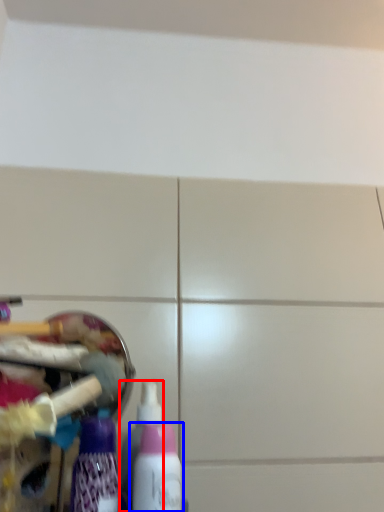
Question: Which of the following is the closest to the observer, bottle (highlighted by a red box) or bottle (highlighted by a blue box)?

Choices:
 (A) bottle
 (B) bottle

Answer: (B)